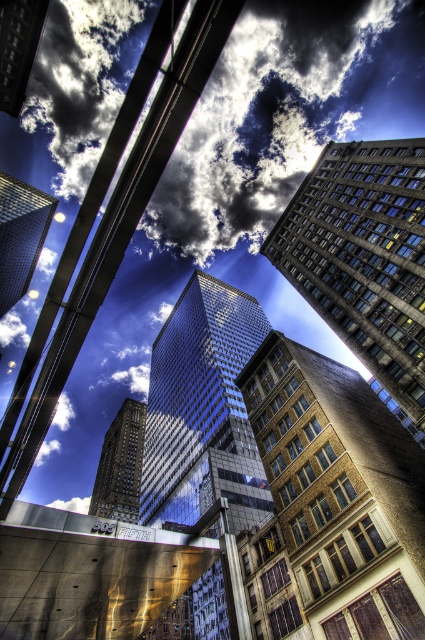
Question: Which of the following is the closest to the observer?

Choices:
 (A) coord(289,244)
 (B) coord(5,51)
 (C) coord(229,461)

Answer: (C)

Question: Is shiny glass skyscraper at left smaller than shiny glass skyscraper at center?

Choices:
 (A) yes
 (B) no

Answer: (B)

Question: Which object appears farthest from the camera in this image?

Choices:
 (A) brown brick building at center
 (B) cloudy sky at upper center
 (C) glassy reflective skyscraper at center
 (D) shiny glass skyscraper at upper left

Answer: (B)

Question: In this image, where is brown brick building at center located relative to shiny glass skyscraper at center?

Choices:
 (A) left
 (B) right

Answer: (B)

Question: Does shiny glass skyscraper at left appear on the right side of shiny glass skyscraper at center?

Choices:
 (A) no
 (B) yes

Answer: (A)

Question: Which point is closer to the camera?

Choices:
 (A) glossy glass skyscraper at center
 (B) shiny glass skyscraper at upper left
 (C) brown brick building at center
 (D) shiny glass skyscraper at center

Answer: (C)